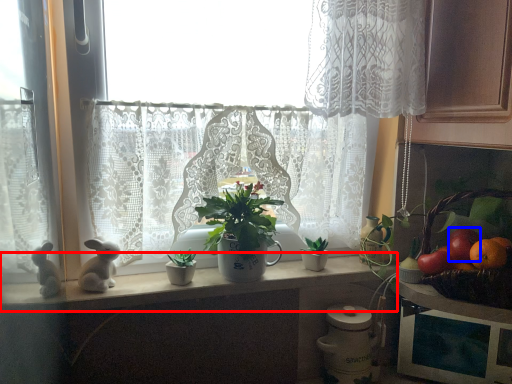
Question: Which of the following is the closest to the observer, counter top (highlighted by a red box) or fruit (highlighted by a blue box)?

Choices:
 (A) counter top
 (B) fruit

Answer: (A)